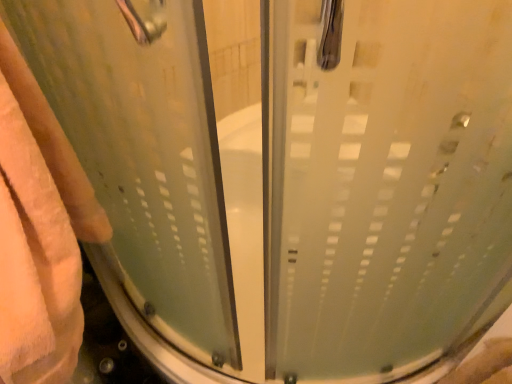
Question: Does frosted glass shower door at center, placed as the 2th screen door when sorted from right to left, have a lesser height compared to frosted glass shower door at center, placed as the 1th screen door when sorted from right to left?

Choices:
 (A) yes
 (B) no

Answer: (B)

Question: Is frosted glass shower door at center, the 1th screen door in the left-to-right sequence, bigger than frosted glass shower door at center, placed as the 1th screen door when sorted from right to left?

Choices:
 (A) no
 (B) yes

Answer: (B)

Question: Is the surface of frosted glass shower door at center, placed as the 2th screen door when sorted from right to left, in direct contact with frosted glass shower door at center, placed as the 1th screen door when sorted from right to left?

Choices:
 (A) no
 (B) yes

Answer: (A)

Question: From a real-world perspective, does frosted glass shower door at center, placed as the 2th screen door when sorted from right to left, stand above frosted glass shower door at center, placed as the 1th screen door when sorted from right to left?

Choices:
 (A) no
 (B) yes

Answer: (B)

Question: Is frosted glass shower door at center, the 1th screen door in the left-to-right sequence, smaller than frosted glass shower door at center, the 2th screen door when ordered from left to right?

Choices:
 (A) yes
 (B) no

Answer: (B)

Question: Considering their positions, is frosted glass shower door at center, the 1th screen door in the left-to-right sequence, located in front of or behind beige fluffy towel at left?

Choices:
 (A) behind
 (B) front

Answer: (B)

Question: Is frosted glass shower door at center, the 1th screen door in the left-to-right sequence, bigger or smaller than beige fluffy towel at left?

Choices:
 (A) small
 (B) big

Answer: (A)

Question: Looking at their shapes, would you say frosted glass shower door at center, placed as the 2th screen door when sorted from right to left, is wider or thinner than beige fluffy towel at left?

Choices:
 (A) wide
 (B) thin

Answer: (B)

Question: Is frosted glass shower door at center, placed as the 2th screen door when sorted from right to left, taller or shorter than beige fluffy towel at left?

Choices:
 (A) short
 (B) tall

Answer: (A)

Question: Based on their positions, is beige fluffy towel at left located to the left or right of frosted glass shower door at center, the 1th screen door in the left-to-right sequence?

Choices:
 (A) right
 (B) left

Answer: (B)

Question: In terms of height, does beige fluffy towel at left look taller or shorter compared to frosted glass shower door at center, the 1th screen door in the left-to-right sequence?

Choices:
 (A) tall
 (B) short

Answer: (A)

Question: From a real-world perspective, is beige fluffy towel at left above or below frosted glass shower door at center, placed as the 2th screen door when sorted from right to left?

Choices:
 (A) below
 (B) above

Answer: (A)

Question: Which is correct: beige fluffy towel at left is inside frosted glass shower door at center, the 1th screen door in the left-to-right sequence, or outside of it?

Choices:
 (A) outside
 (B) inside

Answer: (A)

Question: Considering the positions of frosted glass shower door at center, placed as the 1th screen door when sorted from right to left, and beige fluffy towel at left in the image, is frosted glass shower door at center, placed as the 1th screen door when sorted from right to left, bigger or smaller than beige fluffy towel at left?

Choices:
 (A) big
 (B) small

Answer: (B)

Question: Relative to beige fluffy towel at left, is frosted glass shower door at center, the 2th screen door when ordered from left to right, in front or behind?

Choices:
 (A) front
 (B) behind

Answer: (A)